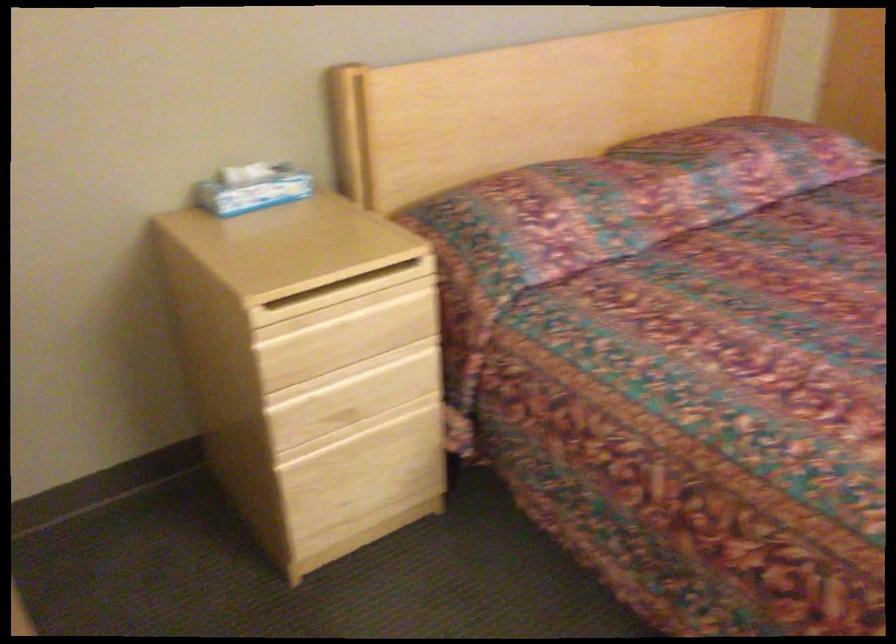
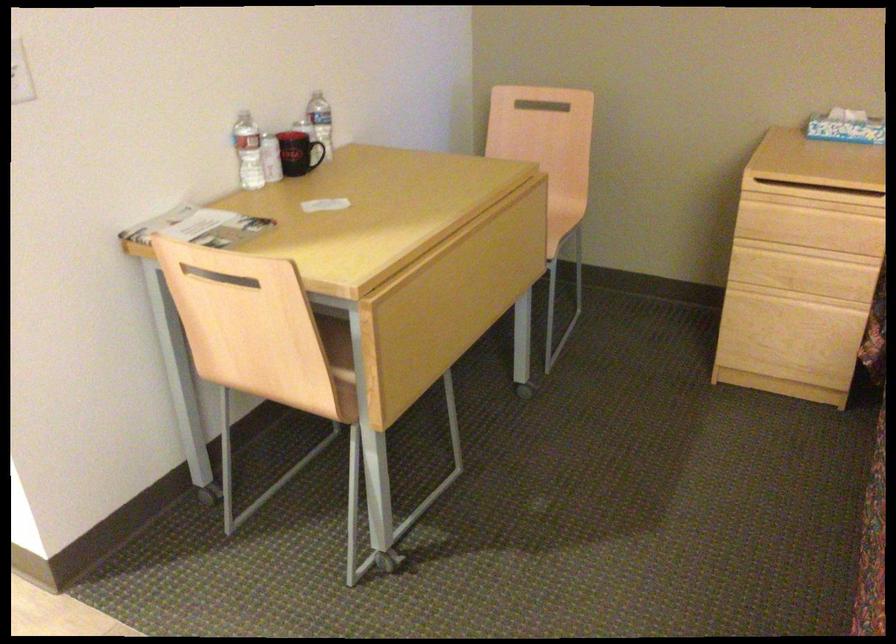
Locate, in the second image, the point that corresponds to (x=263, y=196) in the first image.

(846, 127)